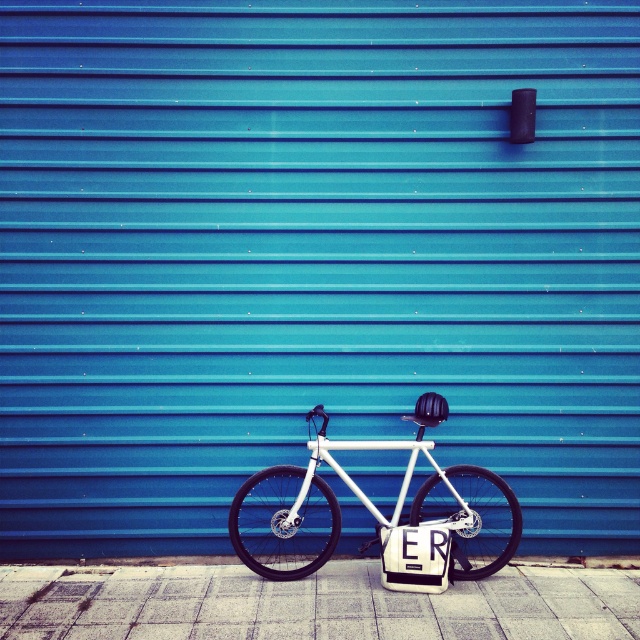
Which is more to the right, gray concrete pavement at lower center or white matte bicycle at center?

white matte bicycle at center

Is point (68, 586) less distant than point (497, 528)?

Yes, it is.

Does point (556, 618) come closer to viewer compared to point (486, 560)?

Yes, point (556, 618) is in front of point (486, 560).

Locate an element on the screen. Image resolution: width=640 pixels, height=640 pixels. gray concrete pavement at lower center is located at coordinates (312, 604).